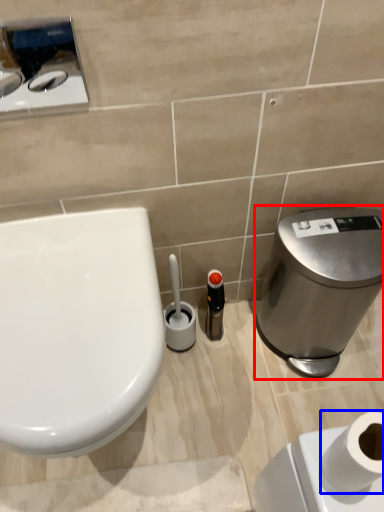
Question: Which object is further to the camera taking this photo, water cooler (highlighted by a red box) or toilet paper (highlighted by a blue box)?

Choices:
 (A) water cooler
 (B) toilet paper

Answer: (A)